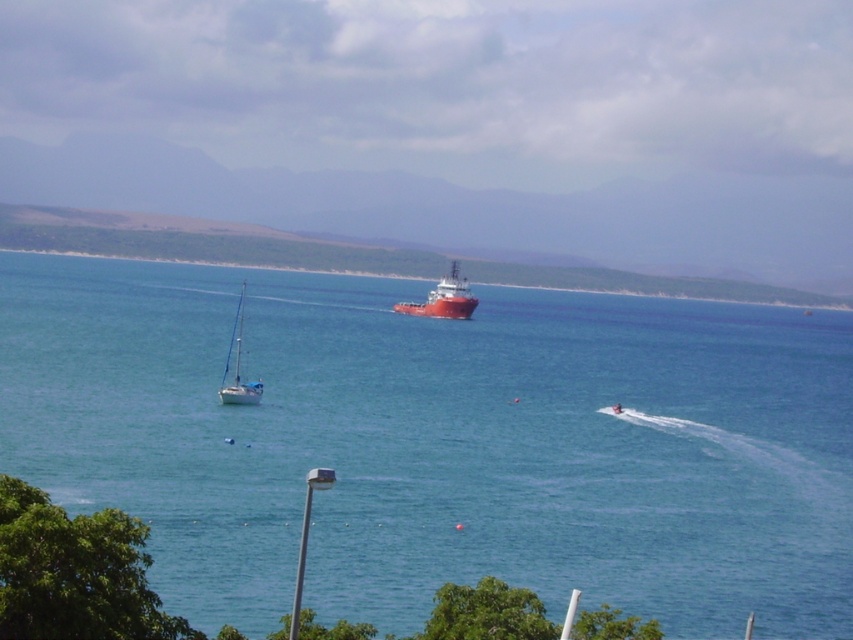
Question: Does red matte ship at center come behind white glossy sailboat at lower left?

Choices:
 (A) no
 (B) yes

Answer: (B)

Question: Among these points, which one is farthest from the camera?

Choices:
 (A) (799, 563)
 (B) (468, 289)
 (C) (241, 317)

Answer: (B)

Question: Is blue water at center below white glossy sailboat at lower left?

Choices:
 (A) no
 (B) yes

Answer: (A)

Question: Is blue water at center above red matte ship at center?

Choices:
 (A) yes
 (B) no

Answer: (B)

Question: Which of these objects is positioned farthest from the white glossy sailboat at lower left?

Choices:
 (A) blue water at center
 (B) red matte ship at center

Answer: (B)

Question: Which point appears farthest from the camera in this image?

Choices:
 (A) (228, 362)
 (B) (38, 477)
 (C) (474, 304)

Answer: (C)